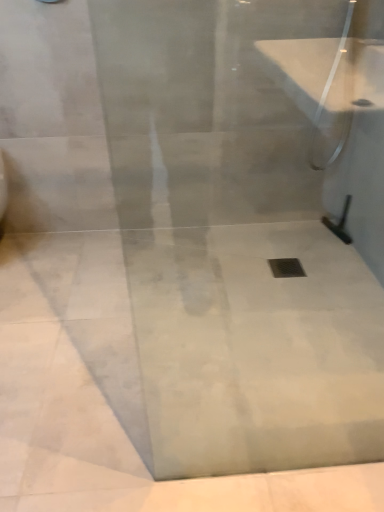
The image size is (384, 512). In order to click on vacant space situated above white marble concrete at center (from a real-world perspective) in this screenshot , I will do `click(174, 345)`.